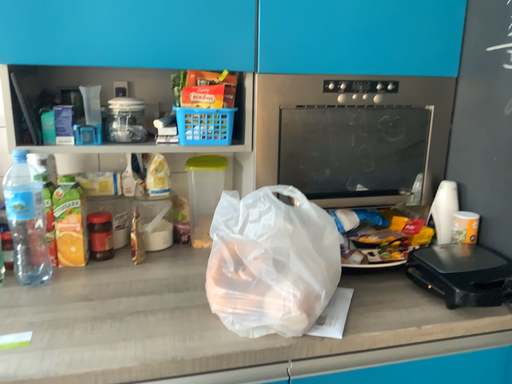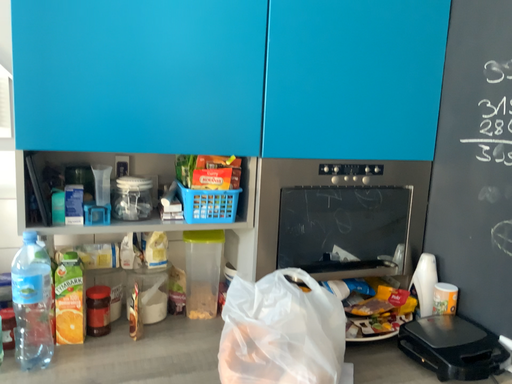
Question: How did the camera likely rotate when shooting the video?

Choices:
 (A) rotated right
 (B) rotated left

Answer: (A)